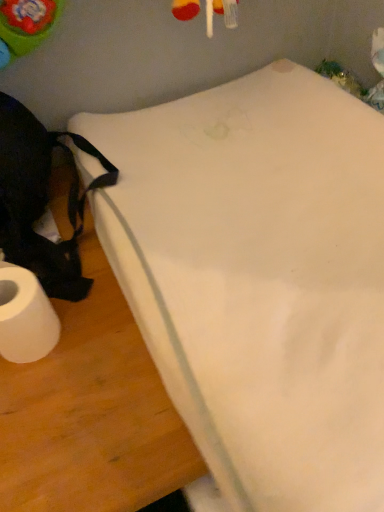
The image size is (384, 512). I want to click on free space in front of white matte toilet paper at lower left, so click(54, 431).